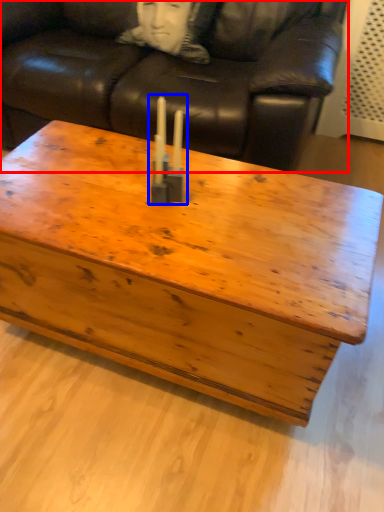
Question: Which object appears closest to the camera in this image, studio couch (highlighted by a red box) or candle holder (highlighted by a blue box)?

Choices:
 (A) studio couch
 (B) candle holder

Answer: (B)